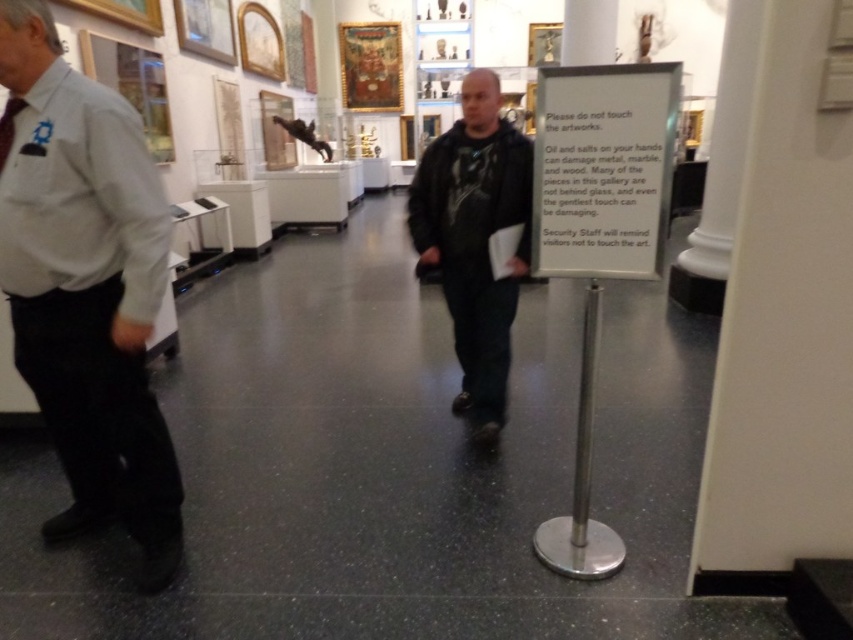
Who is higher up, gray shirt at left or dark green textured shirt at center?

dark green textured shirt at center

Is gray shirt at left thinner than dark green textured shirt at center?

In fact, gray shirt at left might be wider than dark green textured shirt at center.

Is point (4, 257) closer to viewer compared to point (480, 244)?

Yes, point (4, 257) is in front of point (480, 244).

What are the coordinates of `gray shirt at left` in the screenshot? It's located at (86, 285).